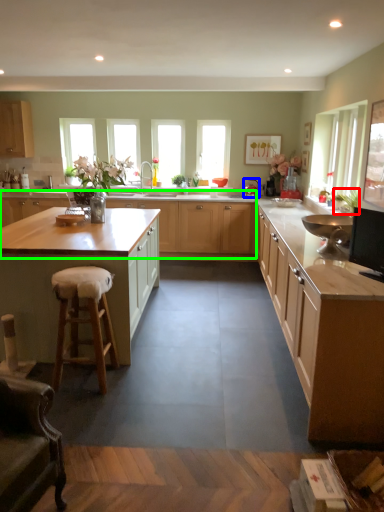
Question: Considering the real-world distances, which object is closest to plant (highlighted by a red box)? appliance (highlighted by a blue box) or cabinetry (highlighted by a green box).

Choices:
 (A) appliance
 (B) cabinetry

Answer: (B)